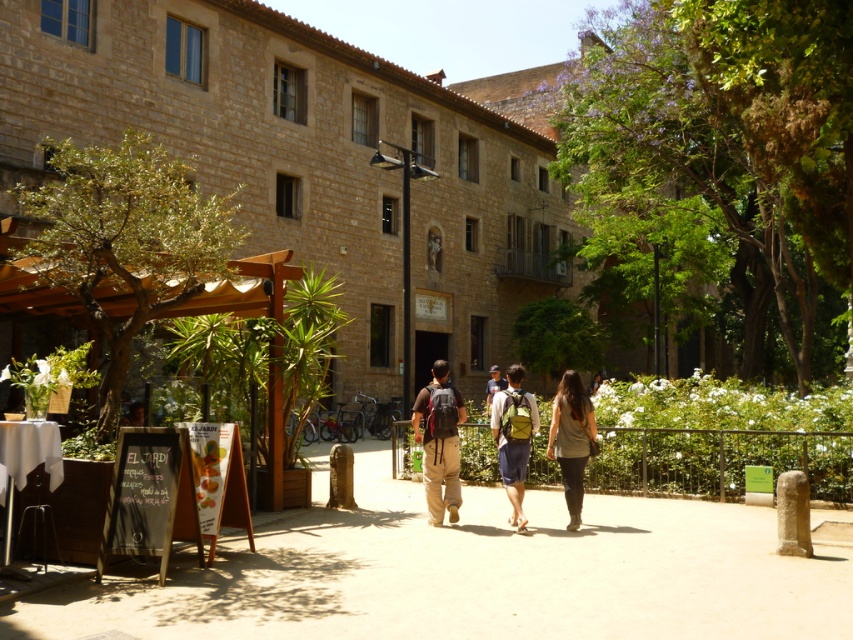
Question: Which of the following is the farthest from the observer?

Choices:
 (A) dark olive-green fabric at center
 (B) green fabric backpack at center
 (C) light brown backpack at center

Answer: (C)

Question: Is matte brown backpack at center wider than light brown backpack at center?

Choices:
 (A) no
 (B) yes

Answer: (A)

Question: Does matte brown backpack at center appear under green fabric backpack at center?

Choices:
 (A) no
 (B) yes

Answer: (A)

Question: Which of these objects is positioned closest to the green fabric backpack at center?

Choices:
 (A) light brown backpack at center
 (B) matte brown backpack at center

Answer: (B)

Question: Can you confirm if matte brown backpack at center is positioned to the right of dark olive-green fabric at center?

Choices:
 (A) yes
 (B) no

Answer: (B)

Question: Which of the following is the closest to the observer?

Choices:
 (A) matte brown backpack at center
 (B) green fabric backpack at center
 (C) dark olive-green fabric at center

Answer: (B)